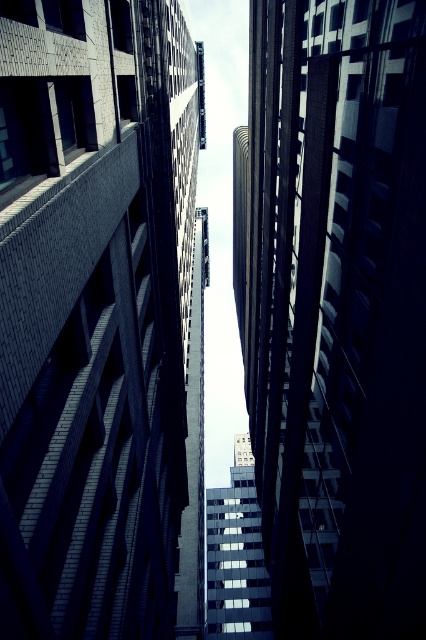
You are a window cleaner with a ladder that can extend up to 8 meters. You need to clean the brick wall at center. Based on the scene, can you safely reach it with your ladder?

The brick wall at center is 9.08 meters away from the viewer, which is beyond the ladder extension limit of 8 meters. Therefore, the ladder cannot safely reach the brick wall at center.

You are a window cleaner with a 9 meter long ladder. You need to clean both the brick wall at center and the smooth glass skyscraper at center. Can you safely reach both walls using your ladder?

The distance between the brick wall at center and the smooth glass skyscraper at center is 8.90 meters. Since your ladder is 9 meters long, it is just long enough to span the gap between them. However, safely using a ladder in this situation would require proper anchoring and safety measures to prevent slipping or instability due to the narrow clearance.